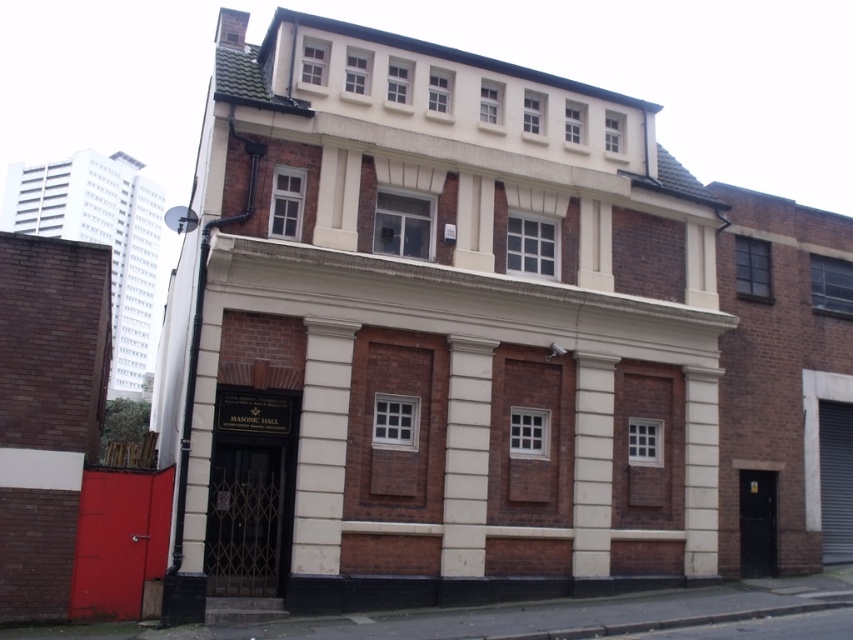
Based on the photo, does white smooth column at center appear over smooth white column at center?

Yes.

Does white smooth column at center appear under smooth white column at center?

Incorrect, white smooth column at center is not positioned below smooth white column at center.

Find the location of `white smooth column at center`. white smooth column at center is located at coordinates (466, 456).

At what (x,y) coordinates should I click in order to perform the action: click on white smooth column at center. Please return your answer as a coordinate pair (x, y). This screenshot has width=853, height=640. Looking at the image, I should click on (466, 456).

Based on the photo, which is more to the left, white smooth column at center or white smooth pillar at center?

white smooth column at center

Image resolution: width=853 pixels, height=640 pixels. In order to click on white smooth column at center in this screenshot , I will do `click(466, 456)`.

What are the coordinates of `white smooth column at center` in the screenshot? It's located at (466, 456).

Does smooth white column at center have a greater width compared to white smooth pillar at center?

No, smooth white column at center is not wider than white smooth pillar at center.

Is smooth white column at center thinner than white smooth pillar at center?

Yes.

Is point (585, 420) positioned before point (703, 515)?

That is True.

Where is `smooth white column at center`? The width and height of the screenshot is (853, 640). smooth white column at center is located at coordinates (592, 465).